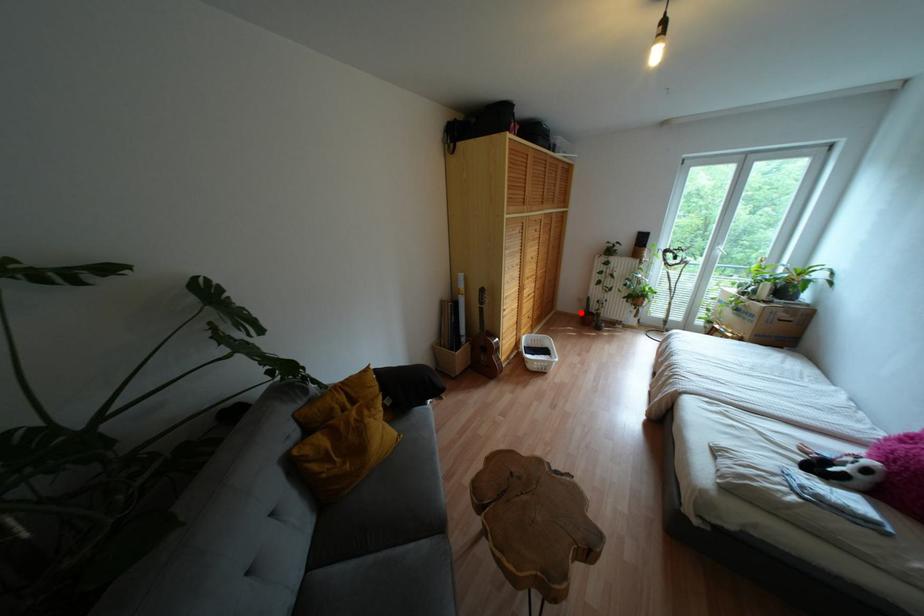
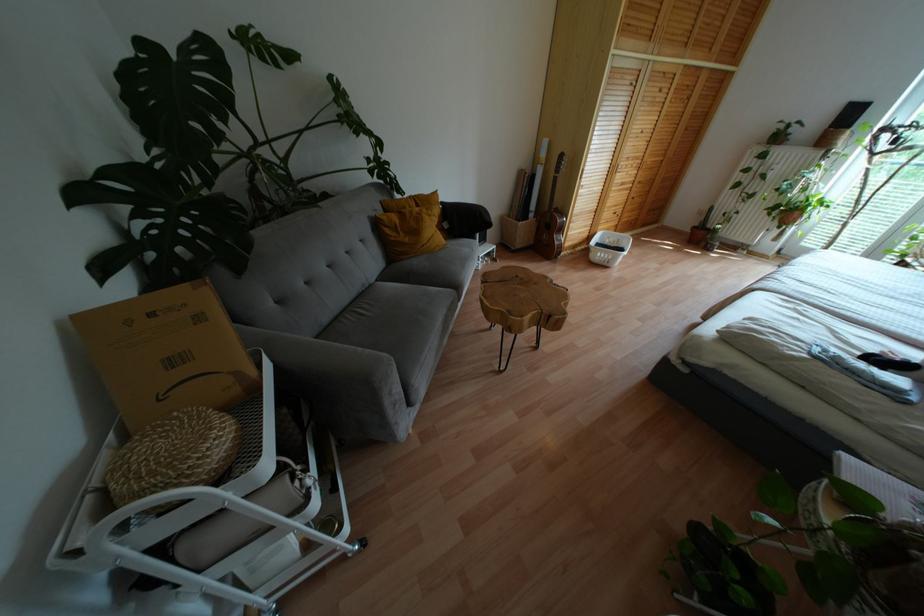
Question: I am providing you with two images of the same scene from different viewpoints. In image1, a red point is highlighted. Considering the same 3D point in image2, which of the following is correct?

Choices:
 (A) It is closer
 (B) It is farther

Answer: (B)